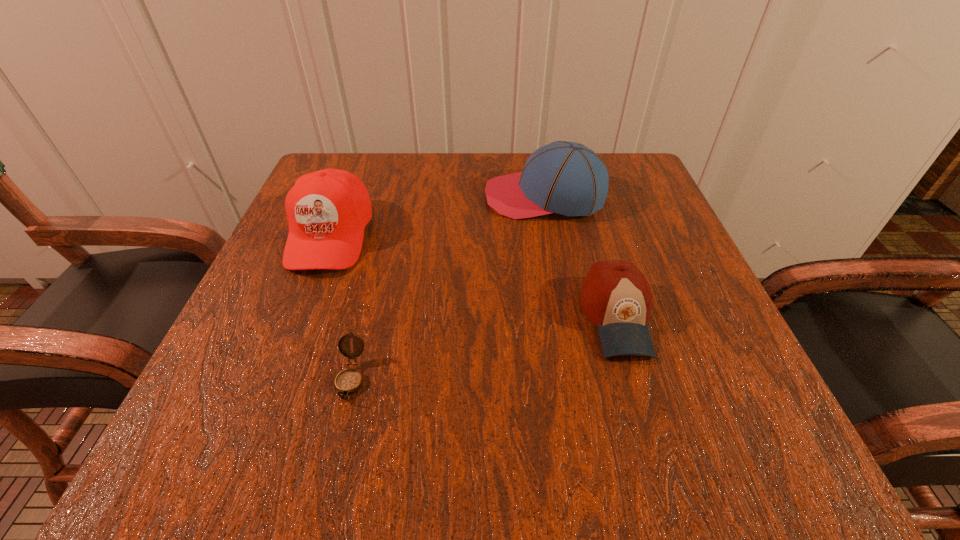
Find the location of `object located at the far left corner`. object located at the far left corner is located at coordinates (327, 210).

Find the location of a particular element. This screenshot has width=960, height=540. object that is at the far right corner is located at coordinates (563, 177).

At what (x,y) coordinates should I click in order to perform the action: click on vacant space at the far edge of the desktop. Please return your answer as a coordinate pair (x, y). The image size is (960, 540). Looking at the image, I should click on (457, 178).

This screenshot has width=960, height=540. In the image, there is a desktop. Identify the location of free space at the near edge. (488, 421).

In the image, there is a desktop. Where is `vacant space at the left edge`? vacant space at the left edge is located at coordinates (351, 271).

Find the location of `vacant region at the right edge`. vacant region at the right edge is located at coordinates (687, 265).

Find the location of a particular element. This screenshot has width=960, height=540. vacant region at the near left corner of the desktop is located at coordinates (260, 423).

Locate an element on the screen. vacant space at the far right corner is located at coordinates point(629,207).

I want to click on blank region between the leftmost baseball cap and the shortest object, so click(x=341, y=307).

Locate an element on the screen. This screenshot has height=540, width=960. free spot between the leftmost object and the nearest baseball cap is located at coordinates (473, 276).